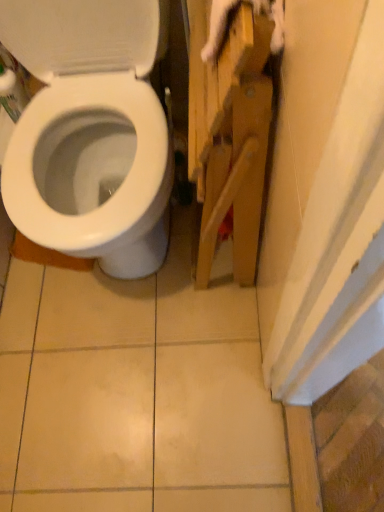
Question: Looking at their shapes, would you say wooden cabinet at right is wider or thinner than white glossy toilet at left?

Choices:
 (A) wide
 (B) thin

Answer: (B)

Question: From the image's perspective, is wooden cabinet at right above or below white glossy toilet at left?

Choices:
 (A) above
 (B) below

Answer: (B)

Question: Is point (231, 199) closer or farther from the camera than point (134, 202)?

Choices:
 (A) closer
 (B) farther

Answer: (A)

Question: From the image's perspective, is white glossy toilet at left positioned above or below wooden cabinet at right?

Choices:
 (A) above
 (B) below

Answer: (A)

Question: In the image, is white glossy toilet at left on the left side or the right side of wooden cabinet at right?

Choices:
 (A) right
 (B) left

Answer: (B)

Question: Considering the positions of white glossy toilet at left and wooden cabinet at right in the image, is white glossy toilet at left wider or thinner than wooden cabinet at right?

Choices:
 (A) wide
 (B) thin

Answer: (A)

Question: Based on their sizes in the image, would you say white glossy toilet at left is bigger or smaller than wooden cabinet at right?

Choices:
 (A) small
 (B) big

Answer: (B)